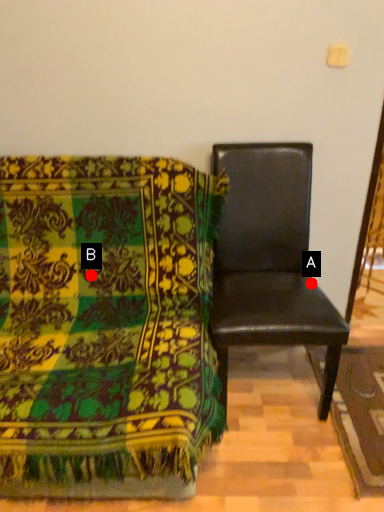
Question: Two points are circled on the image, labeled by A and B beside each circle. Which point is farther to the camera?

Choices:
 (A) A is further
 (B) B is further

Answer: (A)